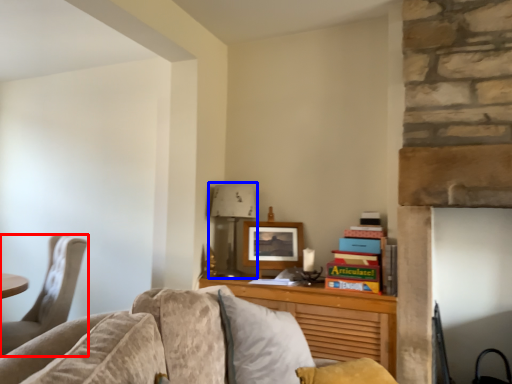
Question: Which point is closer to the camera, chair (highlighted by a red box) or lamp (highlighted by a blue box)?

Choices:
 (A) chair
 (B) lamp

Answer: (A)